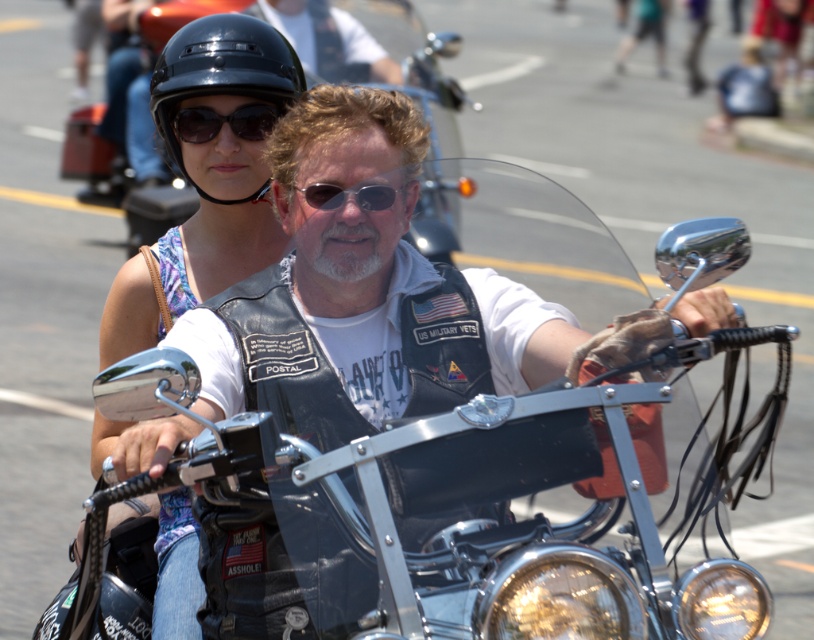
You are a photographer trying to capture the glossy black helmet at upper left in the motorcycle parade image. Based on its position, where should you aim your camera relative to the motorcycle?

The glossy black helmet at upper left is located at point (435, 84), so you should aim your camera slightly to the left and lower than the center of the motorcycle to capture it.

You are a photographer at the motorcycle parade. You need to capture a photo where both the leather vest at center and the black matte helmet at upper center are visible. Which object should you focus on first to ensure both are in frame?

The leather vest at center is smaller than the black matte helmet at upper center, so you should focus on the black matte helmet at upper center first to ensure both are in frame.